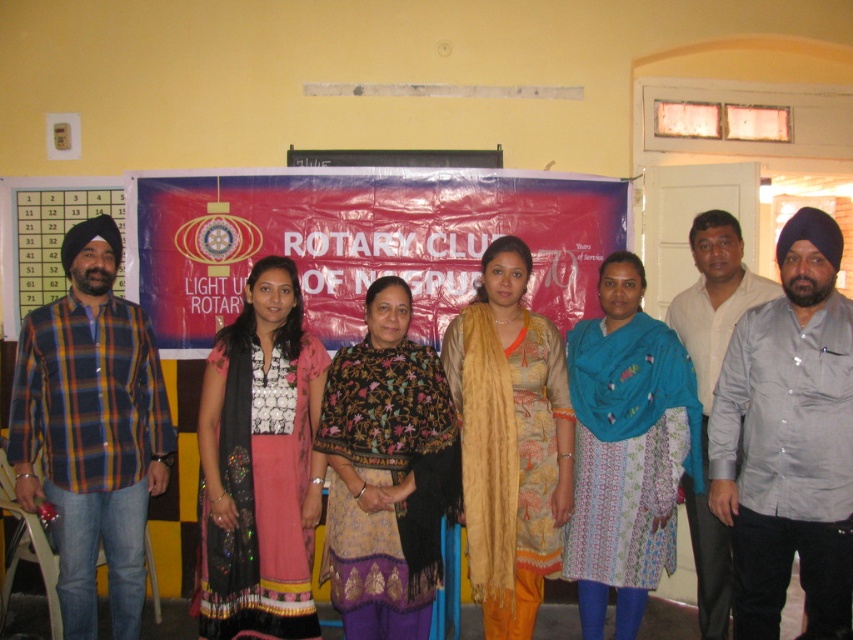
You are a photographer who needs to adjust the lighting between the gray satin shirt at center and the matte black dress at center so they are evenly lit. Given their current distance apart, is this adjustment feasible without moving either subject?

The gray satin shirt at center and the matte black dress at center are 1.65 meters apart. This distance allows the photographer to adjust the lighting between them to achieve even illumination without needing to move either subject.